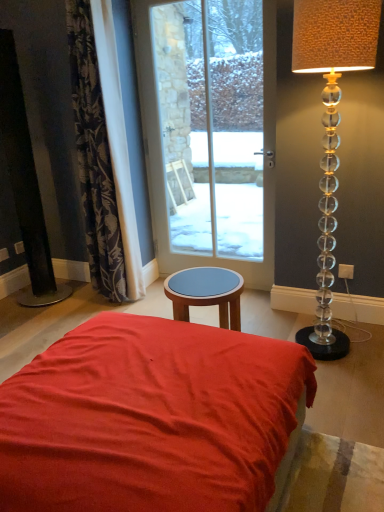
This screenshot has width=384, height=512. Describe the element at coordinates (94, 158) in the screenshot. I see `dark floral fabric curtain at left` at that location.

What is the approximate width of translucent glass lamp at right?

The width of translucent glass lamp at right is 15.15 inches.

What do you see at coordinates (331, 129) in the screenshot?
I see `translucent glass lamp at right` at bounding box center [331, 129].

The width and height of the screenshot is (384, 512). Identify the location of clear glass door at center. (163, 172).

Considering the relative sizes of translucent glass lamp at right and clear glass door at center in the image provided, is translucent glass lamp at right taller than clear glass door at center?

In fact, translucent glass lamp at right may be shorter than clear glass door at center.

Is clear glass door at center completely or partially inside translucent glass lamp at right?

No, translucent glass lamp at right does not contain clear glass door at center.

Consider the image. Considering the positions of objects translucent glass lamp at right and clear glass door at center in the image provided, who is behind, translucent glass lamp at right or clear glass door at center?

clear glass door at center is further away from the camera.

Looking at this image, how much distance is there between clear glass door at center and matte red fabric bed at center?

clear glass door at center is 6.32 feet from matte red fabric bed at center.

From the image's perspective, is clear glass door at center positioned above or below matte red fabric bed at center?

Based on their image positions, clear glass door at center is located above matte red fabric bed at center.

Based on the photo, is clear glass door at center wider or thinner than matte red fabric bed at center?

clear glass door at center is thinner than matte red fabric bed at center.

Is clear glass door at center smaller than matte red fabric bed at center?

Correct, clear glass door at center occupies less space than matte red fabric bed at center.

The image size is (384, 512). I want to click on door that is behind the dark floral fabric curtain at left, so click(x=163, y=172).

Measure the distance from clear glass door at center to dark floral fabric curtain at left.

They are 17.61 inches apart.

From the image's perspective, relative to dark floral fabric curtain at left, is clear glass door at center above or below?

Clearly, from the image's perspective, clear glass door at center is above dark floral fabric curtain at left.

Is clear glass door at center next to dark floral fabric curtain at left and touching it?

clear glass door at center is not next to dark floral fabric curtain at left, and they're not touching.

From a real-world perspective, is translucent glass lamp at right physically below matte red fabric bed at center?

No.

Is matte red fabric bed at center completely or partially inside translucent glass lamp at right?

That's incorrect, matte red fabric bed at center is not inside translucent glass lamp at right.

Can you tell me how much translucent glass lamp at right and matte red fabric bed at center differ in facing direction?

There is a 88.7-degree angle between the facing directions of translucent glass lamp at right and matte red fabric bed at center.

From the image's perspective, is translucent glass lamp at right positioned above or below matte red fabric bed at center?

translucent glass lamp at right is above matte red fabric bed at center.

Between matte red fabric bed at center and clear glass door at center, which one has smaller width?

clear glass door at center is thinner.

Is matte red fabric bed at center inside or outside of clear glass door at center?

matte red fabric bed at center is not inside clear glass door at center, it's outside.

Is matte red fabric bed at center to the left of clear glass door at center from the viewer's perspective?

Yes, matte red fabric bed at center is to the left of clear glass door at center.

The width and height of the screenshot is (384, 512). What are the coordinates of `bed directly beneath the clear glass door at center (from a real-world perspective)` in the screenshot? It's located at (150, 418).

Locate an element on the screen. The height and width of the screenshot is (512, 384). curtain on the left of clear glass door at center is located at coordinates (94, 158).

In the image, is dark floral fabric curtain at left positioned in front of or behind clear glass door at center?

Clearly, dark floral fabric curtain at left is in front of clear glass door at center.

Is dark floral fabric curtain at left at the left side of clear glass door at center?

Yes, dark floral fabric curtain at left is to the left of clear glass door at center.

From the picture: Measure the distance from dark floral fabric curtain at left to clear glass door at center.

A distance of 17.61 inches exists between dark floral fabric curtain at left and clear glass door at center.

Do you think translucent glass lamp at right is within dark floral fabric curtain at left, or outside of it?

translucent glass lamp at right is located beyond the bounds of dark floral fabric curtain at left.

Is translucent glass lamp at right beside dark floral fabric curtain at left?

No, translucent glass lamp at right is not making contact with dark floral fabric curtain at left.

From the image's perspective, is translucent glass lamp at right below dark floral fabric curtain at left?

Correct, translucent glass lamp at right appears lower than dark floral fabric curtain at left in the image.

I want to click on door above the translucent glass lamp at right (from a real-world perspective), so click(163, 172).

This screenshot has width=384, height=512. What are the coordinates of `bed on the left of clear glass door at center` in the screenshot? It's located at (150, 418).

When comparing their distances from clear glass door at center, does dark floral fabric curtain at left or translucent glass lamp at right seem further?

Based on the image, translucent glass lamp at right appears to be further to clear glass door at center.

Looking at the image, which one is located closer to clear glass door at center, matte red fabric bed at center or dark floral fabric curtain at left?

dark floral fabric curtain at left.

Considering their positions, is dark floral fabric curtain at left positioned closer to translucent glass lamp at right than clear glass door at center?

clear glass door at center is closer to translucent glass lamp at right.

Considering their positions, is dark floral fabric curtain at left positioned closer to translucent glass lamp at right than matte red fabric bed at center?

Among the two, matte red fabric bed at center is located nearer to translucent glass lamp at right.

Which object lies nearer to the anchor point dark floral fabric curtain at left, matte red fabric bed at center or translucent glass lamp at right?

translucent glass lamp at right is closer to dark floral fabric curtain at left.

From the image, which object appears to be farther from clear glass door at center, translucent glass lamp at right or matte red fabric bed at center?

matte red fabric bed at center is positioned further to the anchor clear glass door at center.

From the picture: Estimate the real-world distances between objects in this image. Which object is further from dark floral fabric curtain at left, matte red fabric bed at center or clear glass door at center?

matte red fabric bed at center is further to dark floral fabric curtain at left.

Considering their positions, is matte red fabric bed at center positioned closer to translucent glass lamp at right than dark floral fabric curtain at left?

The object closer to translucent glass lamp at right is matte red fabric bed at center.

At what (x,y) coordinates should I click in order to perform the action: click on door between dark floral fabric curtain at left and translucent glass lamp at right from left to right. Please return your answer as a coordinate pair (x, y). This screenshot has height=512, width=384. Looking at the image, I should click on (163, 172).

The height and width of the screenshot is (512, 384). Identify the location of lamp between matte red fabric bed at center and dark floral fabric curtain at left along the z-axis. (331, 129).

At what (x,y) coordinates should I click in order to perform the action: click on curtain between matte red fabric bed at center and clear glass door at center along the z-axis. Please return your answer as a coordinate pair (x, y). Looking at the image, I should click on (94, 158).

Where is `lamp between matte red fabric bed at center and clear glass door at center from front to back`? lamp between matte red fabric bed at center and clear glass door at center from front to back is located at coordinates (x=331, y=129).